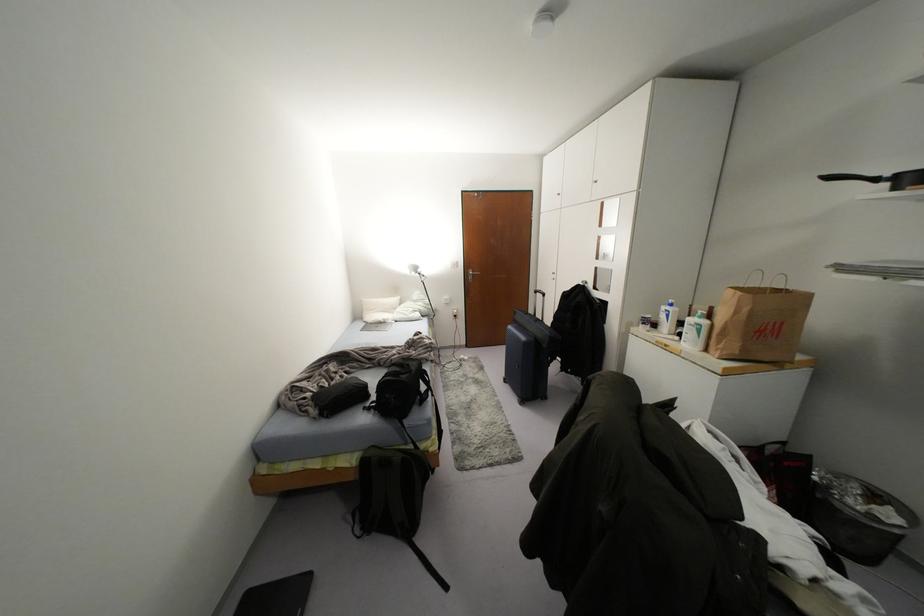
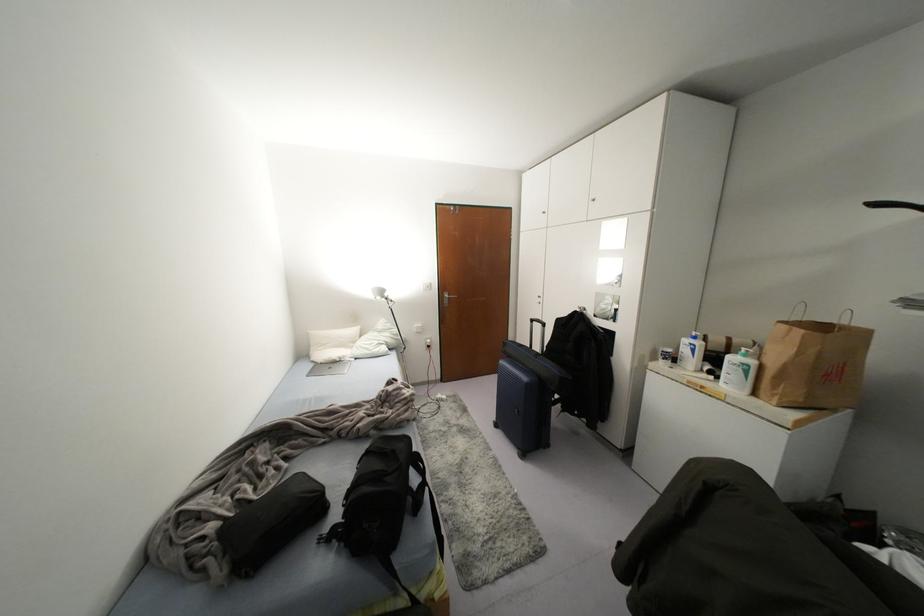
Find the pixel in the second image that matches point 666,315 in the first image.

(691, 350)